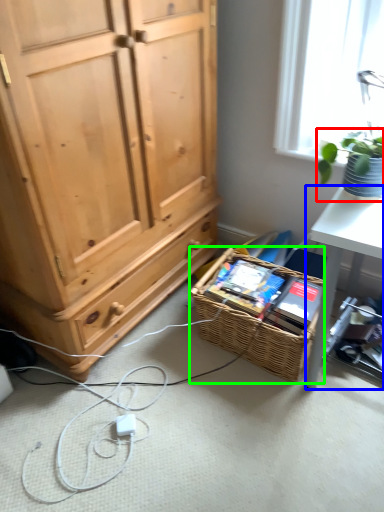
Question: Considering the real-world distances, which object is farthest from houseplant (highlighted by a red box)? desk (highlighted by a blue box) or picnic basket (highlighted by a green box)?

Choices:
 (A) desk
 (B) picnic basket

Answer: (B)